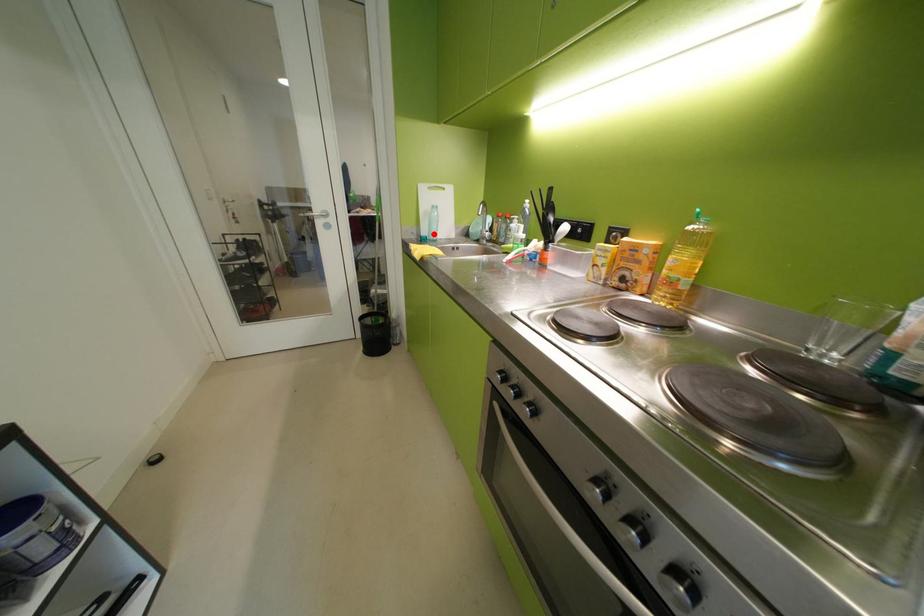
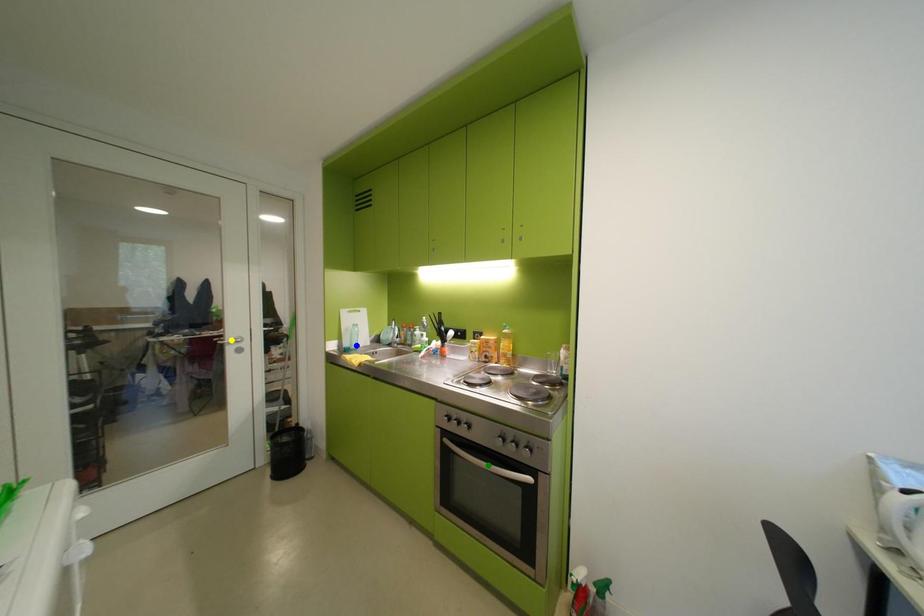
Question: I am providing you with two images of the same scene from different viewpoints. A red point is marked on the first image. You are given multiple points on the second image. In image 2, which mark is for the same physical point as the one in image 1?

Choices:
 (A) blue point
 (B) green point
 (C) yellow point

Answer: (A)